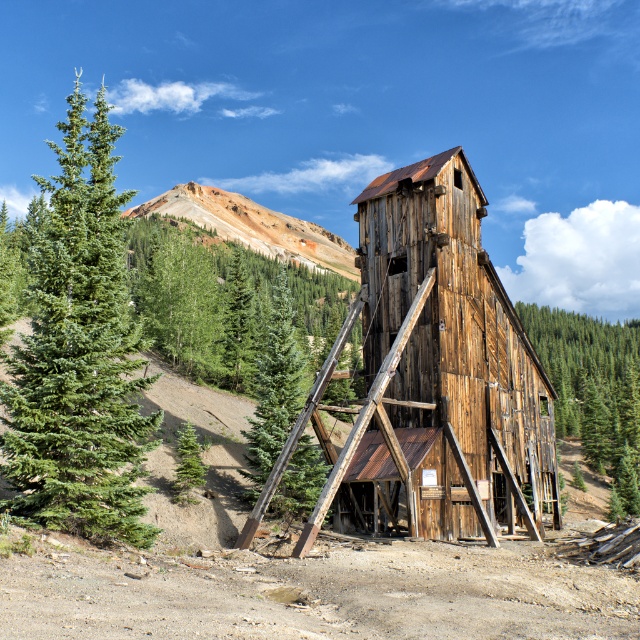
What do you see at coordinates (80, 355) in the screenshot?
I see `green fir tree at left` at bounding box center [80, 355].

Who is shorter, green fir tree at left or green rough wood tree at center?

green rough wood tree at center is shorter.

You are a GUI agent. You are given a task and a screenshot of the screen. Output one action in this format:
    pyautogui.click(x=<x>, y=<y>)
    Task: Click on the green fir tree at left
    Image resolution: width=640 pixels, height=640 pixels.
    Given the screenshot: What is the action you would take?
    pyautogui.click(x=80, y=355)

Who is more forward, (108, 128) or (426, 288)?

Point (108, 128) is in front.

In the scene shown: Does green fir tree at left appear on the left side of rusty wood ladder at center?

Correct, you'll find green fir tree at left to the left of rusty wood ladder at center.

Locate an element on the screen. green fir tree at left is located at coordinates (80, 355).

Identify the location of green fir tree at left. (80, 355).

Consider the image. Between weathered wood tower at center and rustic brown mountain at upper center, which one has less height?

weathered wood tower at center

This screenshot has height=640, width=640. Describe the element at coordinates (452, 353) in the screenshot. I see `weathered wood tower at center` at that location.

What do you see at coordinates (452, 353) in the screenshot? Image resolution: width=640 pixels, height=640 pixels. I see `weathered wood tower at center` at bounding box center [452, 353].

Identify the location of weathered wood tower at center. (452, 353).